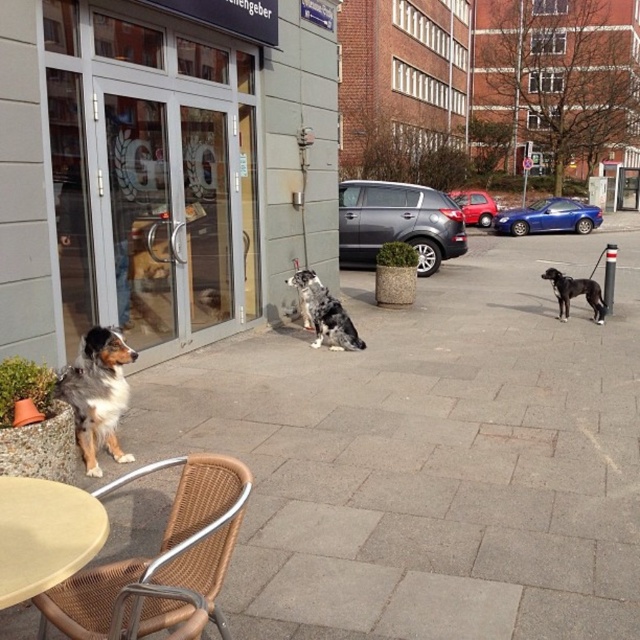
Between transparent glass doors at center and brown and white fur dog at lower left, which one appears on the right side from the viewer's perspective?

brown and white fur dog at lower left is more to the right.

Is transparent glass doors at center further to the viewer compared to brown and white fur dog at lower left?

Yes, transparent glass doors at center is behind brown and white fur dog at lower left.

The image size is (640, 640). What do you see at coordinates (154, 168) in the screenshot? I see `transparent glass doors at center` at bounding box center [154, 168].

You are a GUI agent. You are given a task and a screenshot of the screen. Output one action in this format:
    pyautogui.click(x=<x>, y=<y>)
    Task: Click on the transparent glass doors at center
    Image resolution: width=640 pixels, height=640 pixels.
    Given the screenshot: What is the action you would take?
    pyautogui.click(x=154, y=168)

Which of these two, gray concrete pavement at lower left or rattan chair at lower left, stands taller?

gray concrete pavement at lower left

Does gray concrete pavement at lower left lie in front of rattan chair at lower left?

No, it is behind rattan chair at lower left.

Image resolution: width=640 pixels, height=640 pixels. Find the location of `gray concrete pavement at lower left`. gray concrete pavement at lower left is located at coordinates (429, 458).

Is transparent glass doors at center above shiny blue car at center right?

No, transparent glass doors at center is not above shiny blue car at center right.

Can you confirm if transparent glass doors at center is taller than shiny blue car at center right?

Yes, transparent glass doors at center is taller than shiny blue car at center right.

Image resolution: width=640 pixels, height=640 pixels. Find the location of `transparent glass doors at center`. transparent glass doors at center is located at coordinates (154, 168).